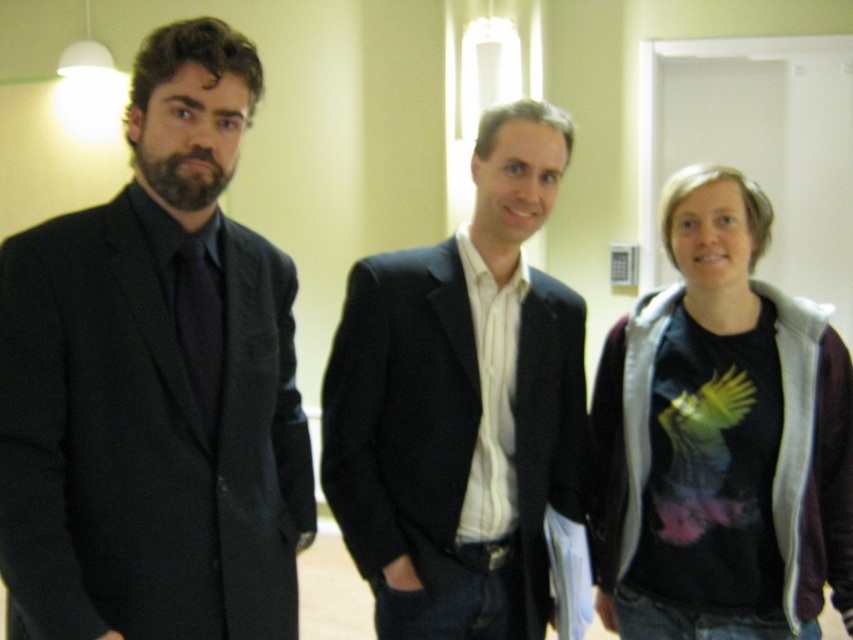
Is matte black suit at left wider than black t-shirt at right?

No, matte black suit at left is not wider than black t-shirt at right.

Which is in front, point (18, 396) or point (706, 314)?

Point (18, 396)

The width and height of the screenshot is (853, 640). What do you see at coordinates (155, 384) in the screenshot?
I see `matte black suit at left` at bounding box center [155, 384].

You are a GUI agent. You are given a task and a screenshot of the screen. Output one action in this format:
    pyautogui.click(x=<x>, y=<y>)
    Task: Click on the matte black suit at left
    This screenshot has width=853, height=640.
    Given the screenshot: What is the action you would take?
    pyautogui.click(x=155, y=384)

Is matte black suit at left positioned behind black matte suit at center?

No.

Between matte black suit at left and black matte suit at center, which one is positioned higher?

matte black suit at left

The image size is (853, 640). What do you see at coordinates (155, 384) in the screenshot?
I see `matte black suit at left` at bounding box center [155, 384].

Image resolution: width=853 pixels, height=640 pixels. What are the coordinates of `matte black suit at left` in the screenshot? It's located at (155, 384).

From the picture: Is black matte suit at center wider than black t-shirt at right?

Correct, the width of black matte suit at center exceeds that of black t-shirt at right.

Does black matte suit at center have a lesser width compared to black t-shirt at right?

In fact, black matte suit at center might be wider than black t-shirt at right.

Identify the location of black matte suit at center. (463, 410).